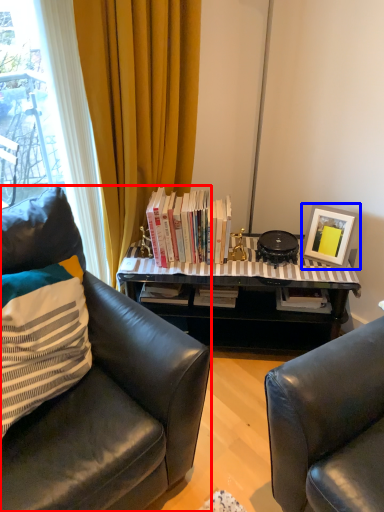
Question: Among these objects, which one is farthest to the camera, chair (highlighted by a red box) or picture frame (highlighted by a blue box)?

Choices:
 (A) chair
 (B) picture frame

Answer: (B)